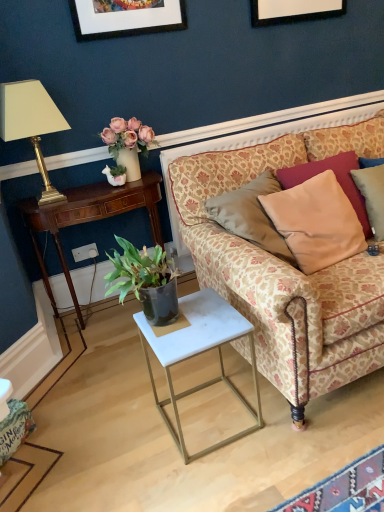
Find the location of a particular element. vacant area that lies in front of mahogany wood desk at left is located at coordinates (103, 367).